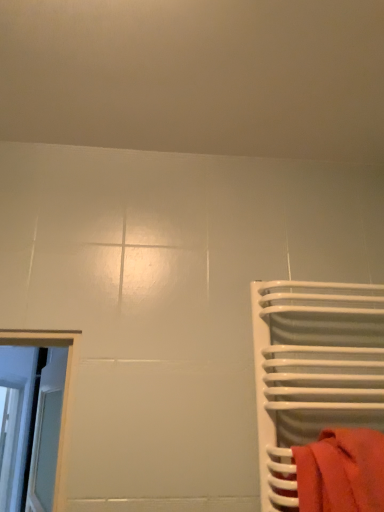
Question: Can you see white glossy towel rack at right touching matte red towel at right?

Choices:
 (A) no
 (B) yes

Answer: (A)

Question: From a real-world perspective, is white glossy towel rack at right on matte red towel at right?

Choices:
 (A) yes
 (B) no

Answer: (A)

Question: Is matte red towel at right at the back of white glossy towel rack at right?

Choices:
 (A) yes
 (B) no

Answer: (A)

Question: Is white glossy towel rack at right at the left side of matte red towel at right?

Choices:
 (A) yes
 (B) no

Answer: (B)

Question: Is white glossy towel rack at right facing towards matte red towel at right?

Choices:
 (A) yes
 (B) no

Answer: (A)

Question: Is white glossy towel rack at right far from matte red towel at right?

Choices:
 (A) no
 (B) yes

Answer: (A)

Question: Is matte red towel at right beside white glossy towel rack at right?

Choices:
 (A) no
 (B) yes

Answer: (A)

Question: Is matte red towel at right thinner than white glossy towel rack at right?

Choices:
 (A) yes
 (B) no

Answer: (A)

Question: From a real-world perspective, is matte red towel at right over white glossy towel rack at right?

Choices:
 (A) no
 (B) yes

Answer: (A)

Question: Is matte red towel at right oriented towards white glossy towel rack at right?

Choices:
 (A) no
 (B) yes

Answer: (A)

Question: Is matte red towel at right closer to camera compared to white glossy towel rack at right?

Choices:
 (A) no
 (B) yes

Answer: (B)

Question: Would you say matte red towel at right contains white glossy towel rack at right?

Choices:
 (A) no
 (B) yes

Answer: (A)

Question: Do you think white glossy towel rack at right is within matte red towel at right, or outside of it?

Choices:
 (A) outside
 (B) inside

Answer: (A)